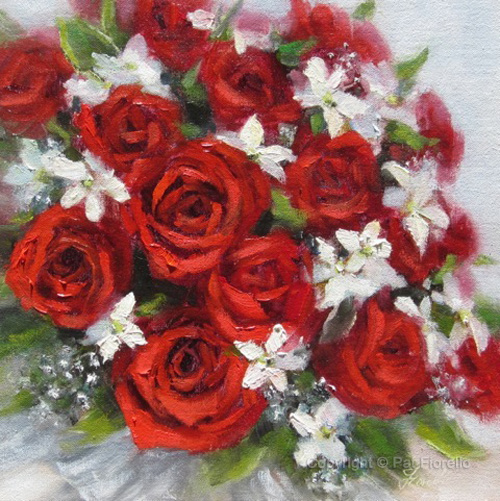
You are a GUI agent. You are given a task and a screenshot of the screen. Output one action in this format:
    pyautogui.click(x=<x>, y=<y>)
    Task: Click on the walls
    This screenshot has height=501, width=500.
    Given the screenshot: What is the action you would take?
    pyautogui.click(x=460, y=68)